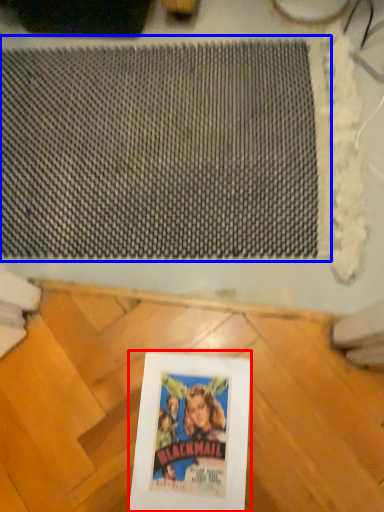
Question: Which point is further to the camera, picture frame (highlighted by a red box) or mat (highlighted by a blue box)?

Choices:
 (A) picture frame
 (B) mat

Answer: (B)